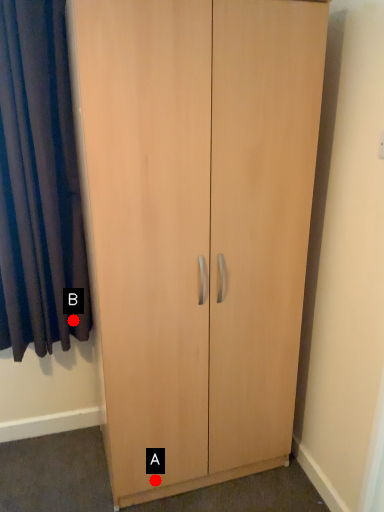
Question: Two points are circled on the image, labeled by A and B beside each circle. Which point is farther to the camera?

Choices:
 (A) A is further
 (B) B is further

Answer: (B)